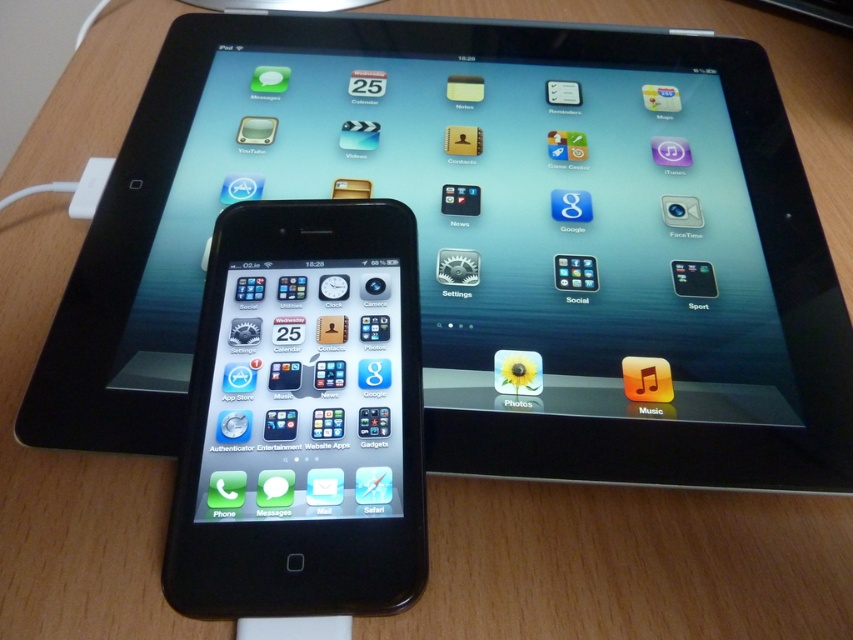
Question: Does black glossy tablet at upper center have a smaller size compared to black glossy tablet at center?

Choices:
 (A) yes
 (B) no

Answer: (B)

Question: Which point appears farthest from the camera in this image?

Choices:
 (A) (769, 205)
 (B) (378, 593)

Answer: (A)

Question: Does black glossy tablet at upper center appear on the right side of black glossy tablet at center?

Choices:
 (A) no
 (B) yes

Answer: (B)

Question: Which point appears closest to the camera in this image?

Choices:
 (A) tap(283, 273)
 (B) tap(93, 250)

Answer: (A)

Question: Is black glossy tablet at upper center below black glossy tablet at center?

Choices:
 (A) yes
 (B) no

Answer: (B)

Question: Which point appears farthest from the camera in this image?

Choices:
 (A) (445, 320)
 (B) (398, 436)

Answer: (A)